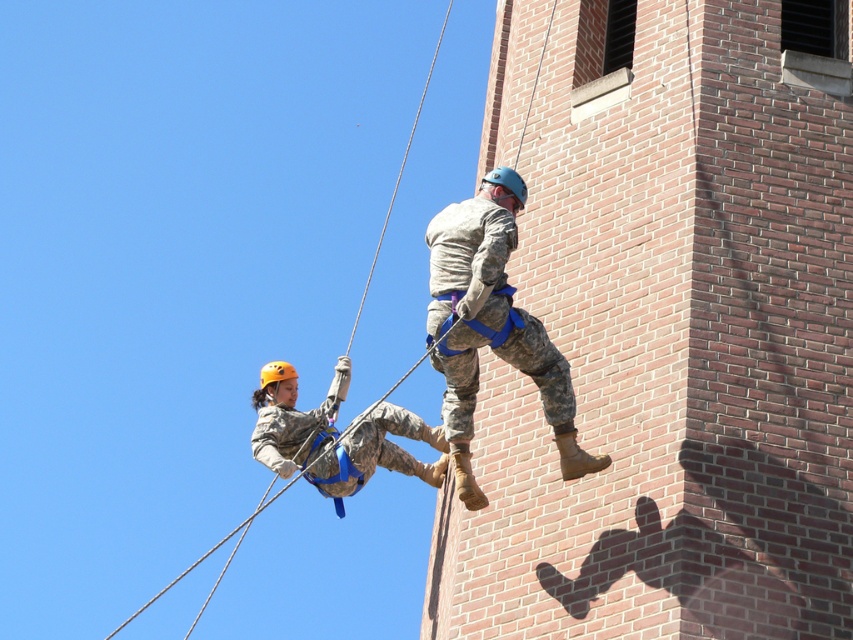
Locate an element on the screen. The image size is (853, 640). camouflage fabric helmet at center is located at coordinates (335, 436).

This screenshot has width=853, height=640. What do you see at coordinates (335, 436) in the screenshot?
I see `camouflage fabric helmet at center` at bounding box center [335, 436].

Locate an element on the screen. The width and height of the screenshot is (853, 640). camouflage fabric helmet at center is located at coordinates (335, 436).

Is point (544, 378) closer to camera compared to point (242, 532)?

Yes, point (544, 378) is closer to viewer.

Which is in front, point (503, 260) or point (154, 595)?

Point (503, 260)

The width and height of the screenshot is (853, 640). In order to click on camouflage fabric uniform at center in this screenshot , I will do `click(490, 324)`.

Which is more to the right, camouflage fabric uniform at center or camouflage fabric helmet at center?

Positioned to the right is camouflage fabric uniform at center.

Where is `camouflage fabric uniform at center`? The image size is (853, 640). camouflage fabric uniform at center is located at coordinates (490, 324).